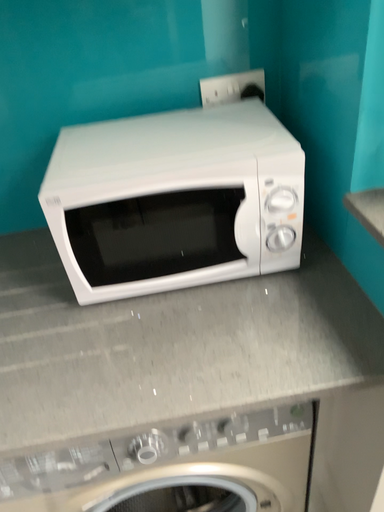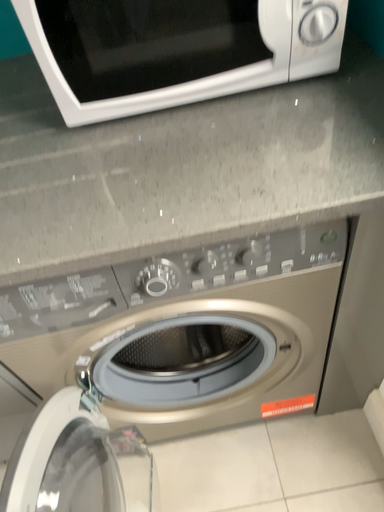
Question: Which way did the camera rotate in the video?

Choices:
 (A) rotated upward
 (B) rotated downward

Answer: (B)